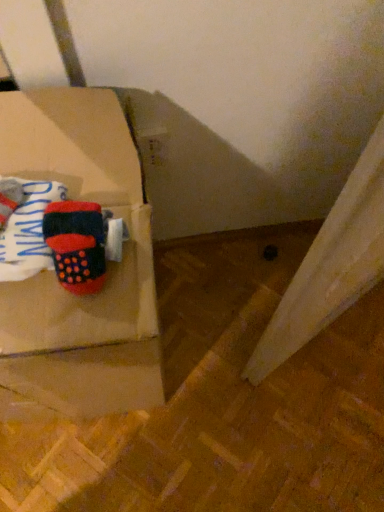
Question: From the image's perspective, is knitted wool socks at left above or below matte cardboard box at left?

Choices:
 (A) below
 (B) above

Answer: (B)

Question: Considering the positions of knitted wool socks at left and matte cardboard box at left in the image, is knitted wool socks at left taller or shorter than matte cardboard box at left?

Choices:
 (A) tall
 (B) short

Answer: (B)

Question: Which of these objects is positioned farthest from the knitted wool socks at left?

Choices:
 (A) matte cardboard box at left
 (B) velvet-like red phone at upper left

Answer: (A)

Question: Based on their relative distances, which object is nearer to the velvet-like red phone at upper left?

Choices:
 (A) matte cardboard box at left
 (B) knitted wool socks at left

Answer: (B)